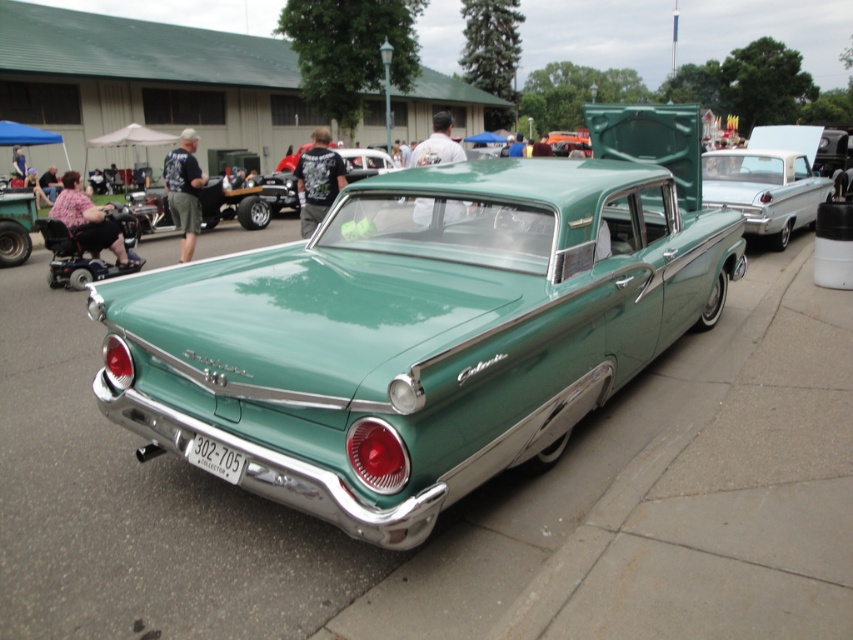
You are standing in front of the vintage car and want to reach both the point at coordinates point (764,202) and point (218,458). Which point is closer to you?

Point (218,458) is closer to you because it is less further to the camera than point (764,202).

You are a photographer at the event and want to take a picture of the shiny silver sedan at center without the white plastic license plate at lower center appearing in the shot. Is it possible to position yourself in a way that the license plate is out of frame?

The white plastic license plate at lower center is behind the shiny silver sedan at center, so yes, you can position yourself so that the license plate is hidden behind the sedan and thus not visible in the photo.